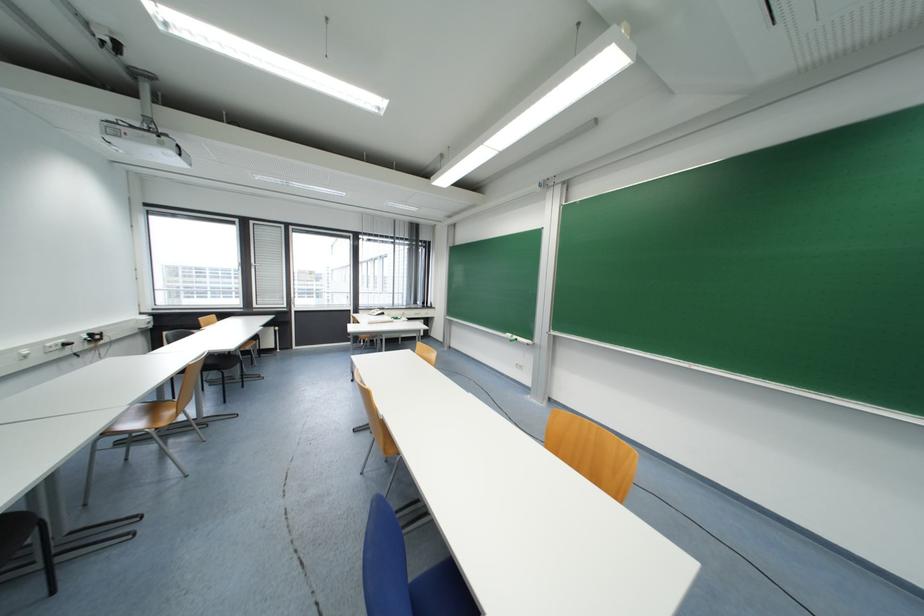
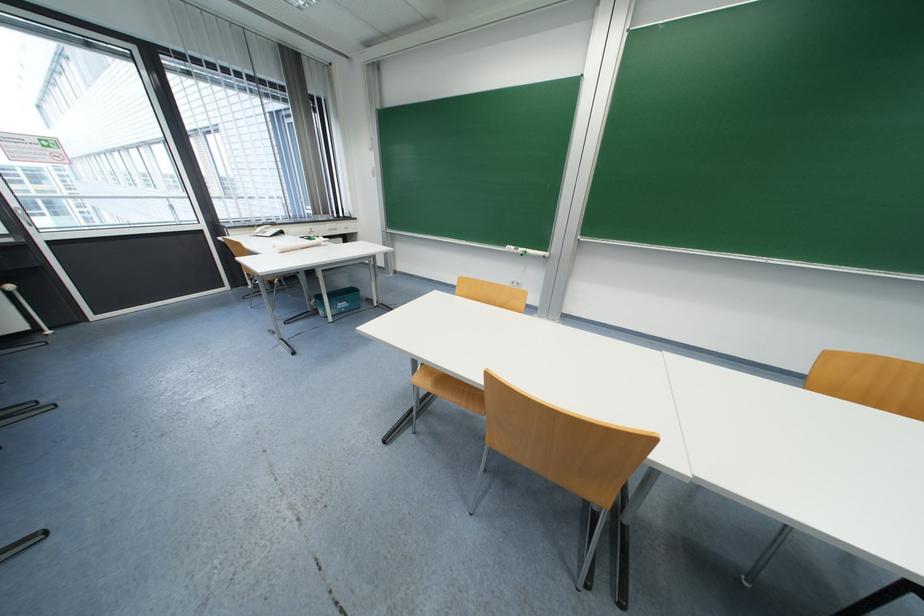
Locate, in the second image, the point that corresponds to the point at 387,310 in the first image.

(277, 225)